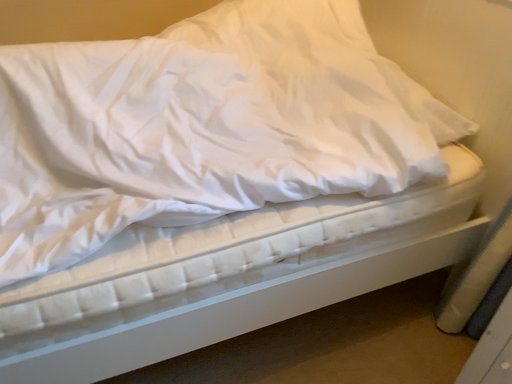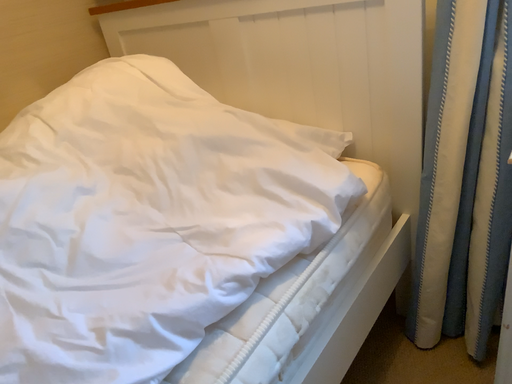
Question: How did the camera likely rotate when shooting the video?

Choices:
 (A) rotated left
 (B) rotated right

Answer: (B)